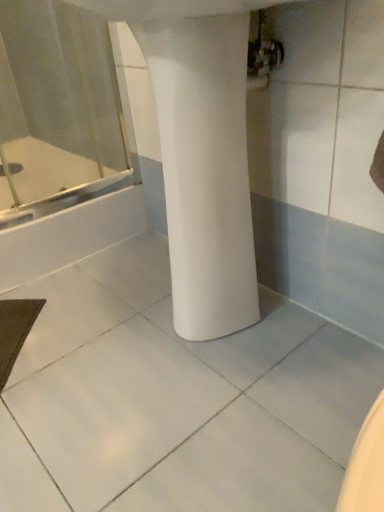
You are a GUI agent. You are given a task and a screenshot of the screen. Output one action in this format:
    pyautogui.click(x=<x>, y=<y>)
    Task: Click on the white glossy bathtub at left
    This screenshot has width=384, height=512.
    Given the screenshot: What is the action you would take?
    (69, 236)

The image size is (384, 512). What do you see at coordinates (69, 236) in the screenshot?
I see `white glossy bathtub at left` at bounding box center [69, 236].

Locate an element on the screen. The height and width of the screenshot is (512, 384). white matte column at center is located at coordinates (205, 170).

The width and height of the screenshot is (384, 512). What do you see at coordinates (205, 170) in the screenshot?
I see `white matte column at center` at bounding box center [205, 170].

You are a GUI agent. You are given a task and a screenshot of the screen. Output one action in this format:
    pyautogui.click(x=<x>, y=<y>)
    Task: Click on the white glossy bathtub at left
    
    Given the screenshot: What is the action you would take?
    pyautogui.click(x=69, y=236)

Based on the photo, is white matte column at center to the left of white glossy bathtub at left from the viewer's perspective?

No, white matte column at center is not to the left of white glossy bathtub at left.

Which object is more forward, white matte column at center or white glossy bathtub at left?

white matte column at center is more forward.

Considering the positions of point (163, 22) and point (59, 258), is point (163, 22) closer or farther from the camera than point (59, 258)?

Point (163, 22) is closer to the camera than point (59, 258).

From the picture: From the image's perspective, which one is positioned lower, white matte column at center or white glossy bathtub at left?

white matte column at center.

From a real-world perspective, which is physically below, white matte column at center or white glossy bathtub at left?

From a 3D spatial view, white glossy bathtub at left is below.

Does white matte column at center have a greater width compared to white glossy bathtub at left?

In fact, white matte column at center might be narrower than white glossy bathtub at left.

Is white matte column at center taller than white glossy bathtub at left?

Indeed, white matte column at center has a greater height compared to white glossy bathtub at left.

Does white matte column at center have a smaller size compared to white glossy bathtub at left?

Yes.

Is white glossy bathtub at left completely or partially inside white matte column at center?

Definitely not — white glossy bathtub at left is not inside white matte column at center.

Would you consider white matte column at center to be distant from white glossy bathtub at left?

Actually, white matte column at center and white glossy bathtub at left are a little close together.

Is white matte column at center looking in the opposite direction of white glossy bathtub at left?

white matte column at center is not turned away from white glossy bathtub at left.

What's the angular difference between white matte column at center and white glossy bathtub at left's facing directions?

90.7 degrees separate the facing orientations of white matte column at center and white glossy bathtub at left.

Measure the distance from white matte column at center to white glossy bathtub at left.

white matte column at center is 21.87 inches away from white glossy bathtub at left.

This screenshot has height=512, width=384. In the image, there is a white glossy bathtub at left. Identify the location of pillar below it (from the image's perspective). (205, 170).

Between white glossy bathtub at left and white matte column at center, which one appears on the right side from the viewer's perspective?

From the viewer's perspective, white matte column at center appears more on the right side.

Which is behind, white glossy bathtub at left or white matte column at center?

white glossy bathtub at left.

Which is behind, point (12, 283) or point (187, 290)?

Positioned behind is point (12, 283).

From the image's perspective, is white glossy bathtub at left located above white matte column at center?

Correct, white glossy bathtub at left appears higher than white matte column at center in the image.

Consider the image. From a real-world perspective, is white glossy bathtub at left beneath white matte column at center?

Indeed, from a real-world perspective, white glossy bathtub at left is positioned beneath white matte column at center.

Can you confirm if white glossy bathtub at left is thinner than white matte column at center?

No, white glossy bathtub at left is not thinner than white matte column at center.

Considering the sizes of objects white glossy bathtub at left and white matte column at center in the image provided, who is shorter, white glossy bathtub at left or white matte column at center?

With less height is white glossy bathtub at left.

Who is smaller, white glossy bathtub at left or white matte column at center?

With smaller size is white matte column at center.

Would you say white glossy bathtub at left contains white matte column at center?

That's incorrect, white matte column at center is not inside white glossy bathtub at left.

Is the surface of white glossy bathtub at left in direct contact with white matte column at center?

They are not placed beside each other.

Could you tell me if white glossy bathtub at left is turned towards white matte column at center?

Yes, white glossy bathtub at left is turned towards white matte column at center.

You are a GUI agent. You are given a task and a screenshot of the screen. Output one action in this format:
    pyautogui.click(x=<x>, y=<y>)
    Task: Click on the bathtub lying above the white matte column at center (from the image's perspective)
    The image size is (384, 512).
    Given the screenshot: What is the action you would take?
    pyautogui.click(x=69, y=236)

At what (x,y) coordinates should I click in order to perform the action: click on bathtub on the left side of white matte column at center. Please return your answer as a coordinate pair (x, y). This screenshot has height=512, width=384. Looking at the image, I should click on (69, 236).

The height and width of the screenshot is (512, 384). I want to click on pillar lying on the right of white glossy bathtub at left, so click(x=205, y=170).